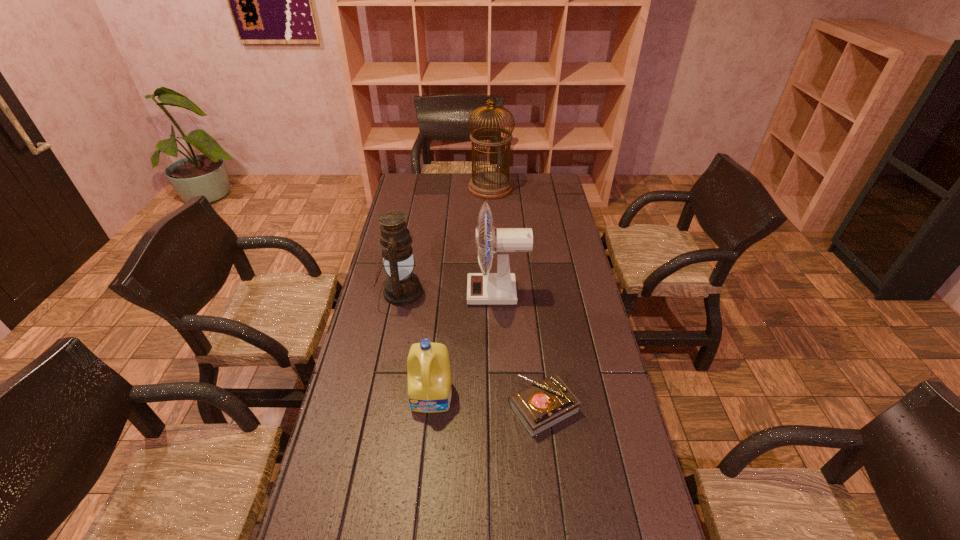
Identify the location of free space that satisfies the following two spatial constraints: 1. on the label of the second object from left to right; 2. on the left side of the shortest object. (431, 408).

The height and width of the screenshot is (540, 960). Identify the location of vacant space that satisfies the following two spatial constraints: 1. on the front-facing side of the birdcage; 2. on the label of the fourth tallest object. (497, 396).

You are a GUI agent. You are given a task and a screenshot of the screen. Output one action in this format:
    pyautogui.click(x=<x>, y=<y>)
    Task: Click on the free spot that satisfies the following two spatial constraints: 1. on the front-facing side of the tallest object; 2. on the front side of the leftmost object
    Image resolution: width=960 pixels, height=540 pixels.
    Given the screenshot: What is the action you would take?
    pyautogui.click(x=494, y=292)

Image resolution: width=960 pixels, height=540 pixels. Identify the location of free space that satisfies the following two spatial constraints: 1. on the front-facing side of the birdcage; 2. on the left side of the shortest object. (498, 408).